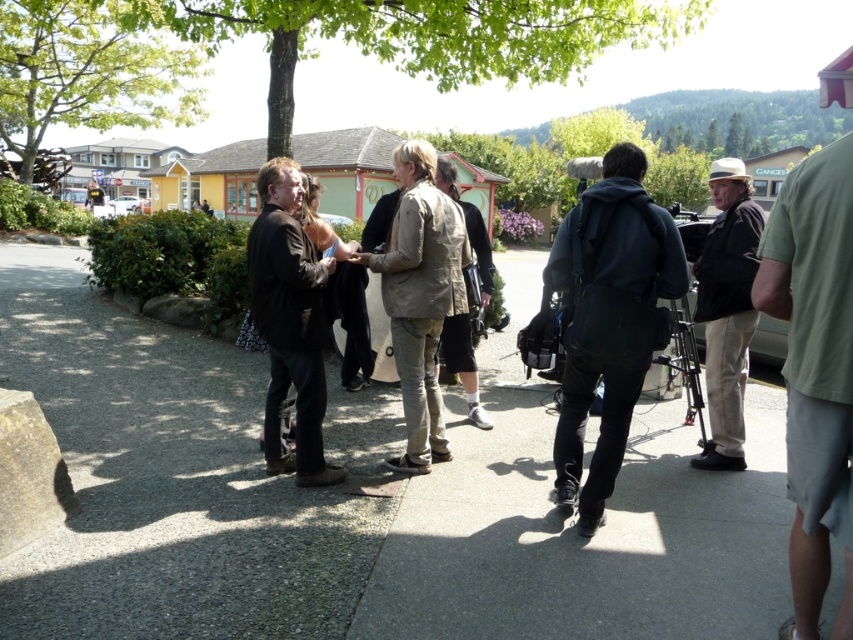
Question: Is khaki textured jacket at center wider than khaki fabric jacket at center?

Choices:
 (A) no
 (B) yes

Answer: (B)

Question: Which is nearer to the green leafy tree at upper center?

Choices:
 (A) dark gray hoodie at center
 (B) khaki textured jacket at center
 (C) khaki fabric jacket at center
 (D) green leafy tree at upper left

Answer: (D)

Question: Among these objects, which one is nearest to the camera?

Choices:
 (A) dark gray hoodie at center
 (B) khaki fabric jacket at center
 (C) green cotton shirt at right

Answer: (C)

Question: Is green leafy tree at upper center closer to the viewer compared to green cotton shirt at right?

Choices:
 (A) no
 (B) yes

Answer: (A)

Question: Is gray asphalt at center above matte black suit at center?

Choices:
 (A) no
 (B) yes

Answer: (A)

Question: Which of the following is the closest to the observer?

Choices:
 (A) khaki textured jacket at center
 (B) matte black suit at center
 (C) khaki cotton pants at center

Answer: (B)